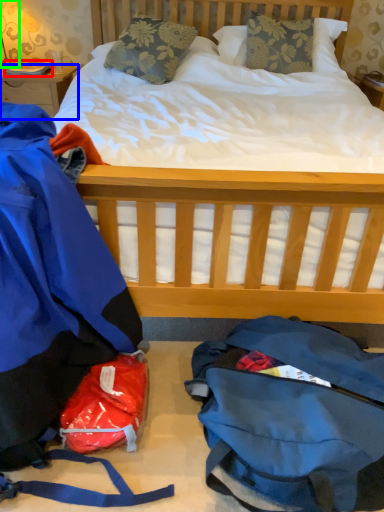
Question: Considering the real-world distances, which object is farthest from book (highlighted by a red box)? desk (highlighted by a blue box) or lamp (highlighted by a green box)?

Choices:
 (A) desk
 (B) lamp

Answer: (B)